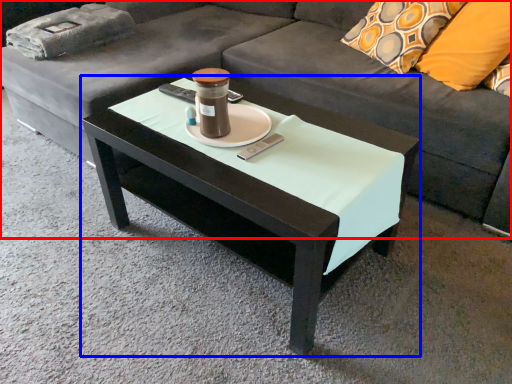
Question: Which point is closer to the camera, studio couch (highlighted by a red box) or coffee table (highlighted by a blue box)?

Choices:
 (A) studio couch
 (B) coffee table

Answer: (A)